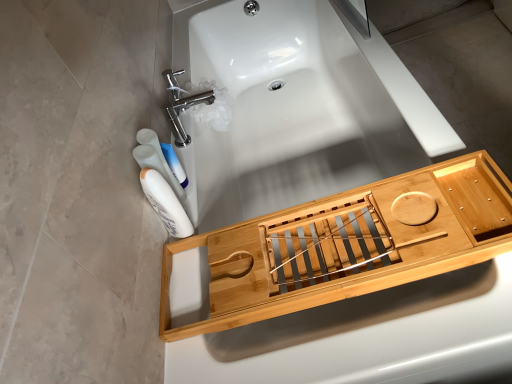
Locate an element on the screen. free space above natural wood bath caddy at lower right (from a real-world perspective) is located at coordinates (342, 233).